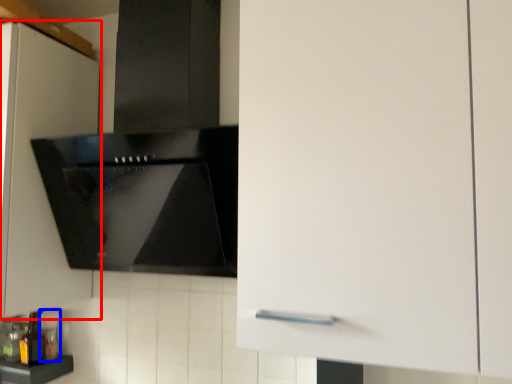
Question: Which object is closer to the camera taking this photo, cabinetry (highlighted by a red box) or bottle (highlighted by a blue box)?

Choices:
 (A) cabinetry
 (B) bottle

Answer: (A)